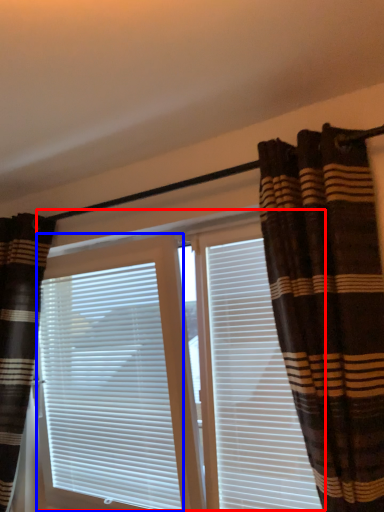
Question: Which object is further to the camera taking this photo, bay window (highlighted by a red box) or window blind (highlighted by a blue box)?

Choices:
 (A) bay window
 (B) window blind

Answer: (B)